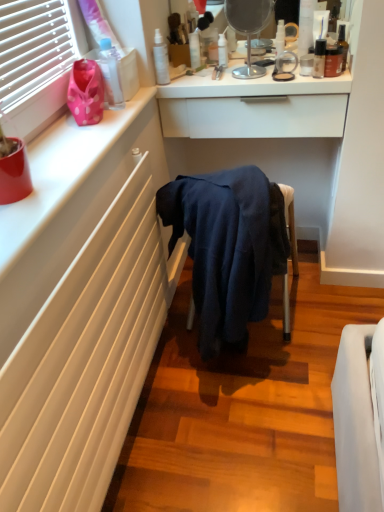
This screenshot has width=384, height=512. I want to click on vacant space that is in between metallic silver mirror at upper center and satin white spray bottle at upper center, the 2th toiletry from the left, so click(x=200, y=79).